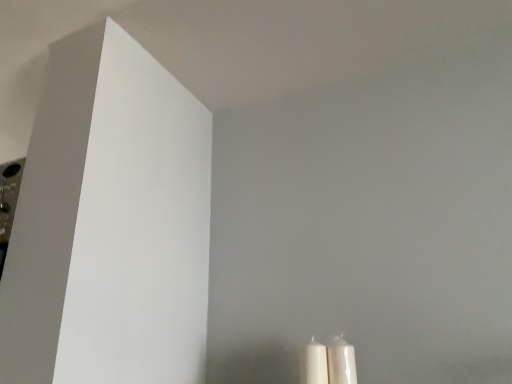
What do you see at coordinates (341, 361) in the screenshot? The height and width of the screenshot is (384, 512). I see `white glossy candle at lower right, positioned as the first candle in right-to-left order` at bounding box center [341, 361].

What is the approximate width of white glossy candle at lower right, positioned as the first candle in right-to-left order?

The width of white glossy candle at lower right, positioned as the first candle in right-to-left order, is 7.94 centimeters.

Where is `white glossy candle at lower right, which ranks as the second candle in left-to-right order`? The width and height of the screenshot is (512, 384). white glossy candle at lower right, which ranks as the second candle in left-to-right order is located at coordinates (341, 361).

The height and width of the screenshot is (384, 512). What do you see at coordinates (314, 364) in the screenshot?
I see `white matte candle at lower right, which ranks as the first candle in left-to-right order` at bounding box center [314, 364].

Where is `white matte candle at lower right, which ranks as the first candle in left-to-right order`? white matte candle at lower right, which ranks as the first candle in left-to-right order is located at coordinates (314, 364).

From the picture: What is the approximate width of white matte candle at lower right, which ranks as the first candle in left-to-right order?

It is 8.63 centimeters.

Find the location of a particular element. This screenshot has height=384, width=512. white glossy candle at lower right, positioned as the first candle in right-to-left order is located at coordinates (341, 361).

Considering the positions of objects white matte candle at lower right, which ranks as the first candle in left-to-right order, and white glossy candle at lower right, which ranks as the second candle in left-to-right order, in the image provided, who is more to the left, white matte candle at lower right, which ranks as the first candle in left-to-right order, or white glossy candle at lower right, which ranks as the second candle in left-to-right order,?

white matte candle at lower right, which ranks as the first candle in left-to-right order, is more to the left.

Relative to white glossy candle at lower right, positioned as the first candle in right-to-left order, is white matte candle at lower right, which ranks as the first candle in left-to-right order, in front or behind?

Clearly, white matte candle at lower right, which ranks as the first candle in left-to-right order, is in front of white glossy candle at lower right, positioned as the first candle in right-to-left order.

Considering the positions of point (315, 344) and point (350, 373), is point (315, 344) closer or farther from the camera than point (350, 373)?

Point (315, 344).

From the image's perspective, does white matte candle at lower right, which ranks as the first candle in left-to-right order, appear lower than white glossy candle at lower right, which ranks as the second candle in left-to-right order?

Yes, from the image's perspective, white matte candle at lower right, which ranks as the first candle in left-to-right order, is below white glossy candle at lower right, which ranks as the second candle in left-to-right order.

From a real-world perspective, is white matte candle at lower right, which ranks as the first candle in left-to-right order, positioned above or below white glossy candle at lower right, which ranks as the second candle in left-to-right order?

From a real-world perspective, white matte candle at lower right, which ranks as the first candle in left-to-right order, is physically above white glossy candle at lower right, which ranks as the second candle in left-to-right order.

Can you confirm if white matte candle at lower right, which ranks as the first candle in left-to-right order, is thinner than white glossy candle at lower right, which ranks as the second candle in left-to-right order?

Incorrect, the width of white matte candle at lower right, which ranks as the first candle in left-to-right order, is not less than that of white glossy candle at lower right, which ranks as the second candle in left-to-right order.

Between white matte candle at lower right, the 2th candle when ordered from right to left, and white glossy candle at lower right, positioned as the first candle in right-to-left order, which one has less height?

white glossy candle at lower right, positioned as the first candle in right-to-left order.

In terms of size, does white matte candle at lower right, which ranks as the first candle in left-to-right order, appear bigger or smaller than white glossy candle at lower right, which ranks as the second candle in left-to-right order?

Considering their sizes, white matte candle at lower right, which ranks as the first candle in left-to-right order, takes up more space than white glossy candle at lower right, which ranks as the second candle in left-to-right order.

Is white matte candle at lower right, the 2th candle when ordered from right to left, spatially inside white glossy candle at lower right, positioned as the first candle in right-to-left order, or outside of it?

The correct answer is: outside.

Is white matte candle at lower right, the 2th candle when ordered from right to left, in contact with white glossy candle at lower right, positioned as the first candle in right-to-left order?

Indeed, white matte candle at lower right, the 2th candle when ordered from right to left, and white glossy candle at lower right, positioned as the first candle in right-to-left order, are beside each other and touching.

Is white glossy candle at lower right, positioned as the first candle in right-to-left order, at the back of white matte candle at lower right, which ranks as the first candle in left-to-right order?

No.

You are a GUI agent. You are given a task and a screenshot of the screen. Output one action in this format:
    pyautogui.click(x=<x>, y=<y>)
    Task: Click on the candle in front of the white glossy candle at lower right, which ranks as the second candle in left-to-right order
    This screenshot has height=384, width=512.
    Given the screenshot: What is the action you would take?
    pyautogui.click(x=314, y=364)

Considering the relative positions of white glossy candle at lower right, positioned as the first candle in right-to-left order, and white matte candle at lower right, which ranks as the first candle in left-to-right order, in the image provided, is white glossy candle at lower right, positioned as the first candle in right-to-left order, to the right of white matte candle at lower right, which ranks as the first candle in left-to-right order, from the viewer's perspective?

Correct, you'll find white glossy candle at lower right, positioned as the first candle in right-to-left order, to the right of white matte candle at lower right, which ranks as the first candle in left-to-right order.

Is the position of white glossy candle at lower right, positioned as the first candle in right-to-left order, less distant than that of white matte candle at lower right, the 2th candle when ordered from right to left?

No, it is behind white matte candle at lower right, the 2th candle when ordered from right to left.

Which point is more forward, (327, 355) or (326, 371)?

Point (326, 371)

From the image's perspective, relative to white matte candle at lower right, which ranks as the first candle in left-to-right order, is white glossy candle at lower right, positioned as the first candle in right-to-left order, above or below?

white glossy candle at lower right, positioned as the first candle in right-to-left order, is above white matte candle at lower right, which ranks as the first candle in left-to-right order.

From a real-world perspective, is white glossy candle at lower right, which ranks as the second candle in left-to-right order, physically above white matte candle at lower right, the 2th candle when ordered from right to left?

Incorrect, from a real-world perspective, white glossy candle at lower right, which ranks as the second candle in left-to-right order, is lower than white matte candle at lower right, the 2th candle when ordered from right to left.

Does white glossy candle at lower right, positioned as the first candle in right-to-left order, have a lesser width compared to white matte candle at lower right, which ranks as the first candle in left-to-right order?

Yes, white glossy candle at lower right, positioned as the first candle in right-to-left order, is thinner than white matte candle at lower right, which ranks as the first candle in left-to-right order.

Considering the relative sizes of white glossy candle at lower right, which ranks as the second candle in left-to-right order, and white matte candle at lower right, which ranks as the first candle in left-to-right order, in the image provided, is white glossy candle at lower right, which ranks as the second candle in left-to-right order, shorter than white matte candle at lower right, which ranks as the first candle in left-to-right order,?

Indeed, white glossy candle at lower right, which ranks as the second candle in left-to-right order, has a lesser height compared to white matte candle at lower right, which ranks as the first candle in left-to-right order.

Considering the relative sizes of white glossy candle at lower right, positioned as the first candle in right-to-left order, and white matte candle at lower right, which ranks as the first candle in left-to-right order, in the image provided, is white glossy candle at lower right, positioned as the first candle in right-to-left order, bigger than white matte candle at lower right, which ranks as the first candle in left-to-right order,?

No.

Choose the correct answer: Is white glossy candle at lower right, positioned as the first candle in right-to-left order, inside white matte candle at lower right, which ranks as the first candle in left-to-right order, or outside it?

white glossy candle at lower right, positioned as the first candle in right-to-left order, cannot be found inside white matte candle at lower right, which ranks as the first candle in left-to-right order.

Would you say white glossy candle at lower right, positioned as the first candle in right-to-left order, is a long distance from white matte candle at lower right, which ranks as the first candle in left-to-right order?

No.

Is white glossy candle at lower right, positioned as the first candle in right-to-left order, looking in the opposite direction of white matte candle at lower right, the 2th candle when ordered from right to left?

white glossy candle at lower right, positioned as the first candle in right-to-left order, is not turned away from white matte candle at lower right, the 2th candle when ordered from right to left.

What's the angular difference between white glossy candle at lower right, which ranks as the second candle in left-to-right order, and white matte candle at lower right, the 2th candle when ordered from right to left,'s facing directions?

They differ by 0.00116 degrees in their facing directions.

How much distance is there between white glossy candle at lower right, which ranks as the second candle in left-to-right order, and white matte candle at lower right, the 2th candle when ordered from right to left?

white glossy candle at lower right, which ranks as the second candle in left-to-right order, and white matte candle at lower right, the 2th candle when ordered from right to left, are 4.43 centimeters apart from each other.

At what (x,y) coordinates should I click in order to perform the action: click on candle below the white glossy candle at lower right, which ranks as the second candle in left-to-right order (from the image's perspective). Please return your answer as a coordinate pair (x, y). Looking at the image, I should click on (314, 364).

Image resolution: width=512 pixels, height=384 pixels. Find the location of `candle below the white matte candle at lower right, the 2th candle when ordered from right to left (from a real-world perspective)`. candle below the white matte candle at lower right, the 2th candle when ordered from right to left (from a real-world perspective) is located at coordinates (341, 361).

Identify the location of candle in front of the white glossy candle at lower right, positioned as the first candle in right-to-left order. The image size is (512, 384). (314, 364).